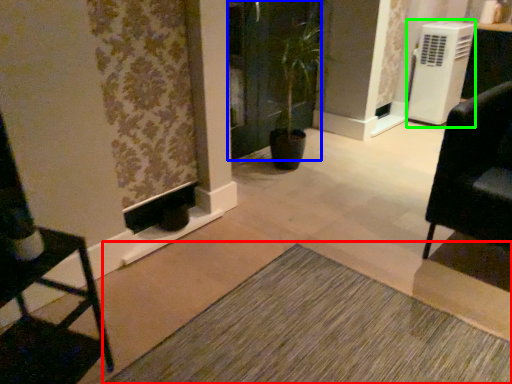
Question: Which object is the farthest from doormat (highlighted by a red box)? Choose among these: screen door (highlighted by a blue box) or air conditioning (highlighted by a green box).

Choices:
 (A) screen door
 (B) air conditioning

Answer: (B)